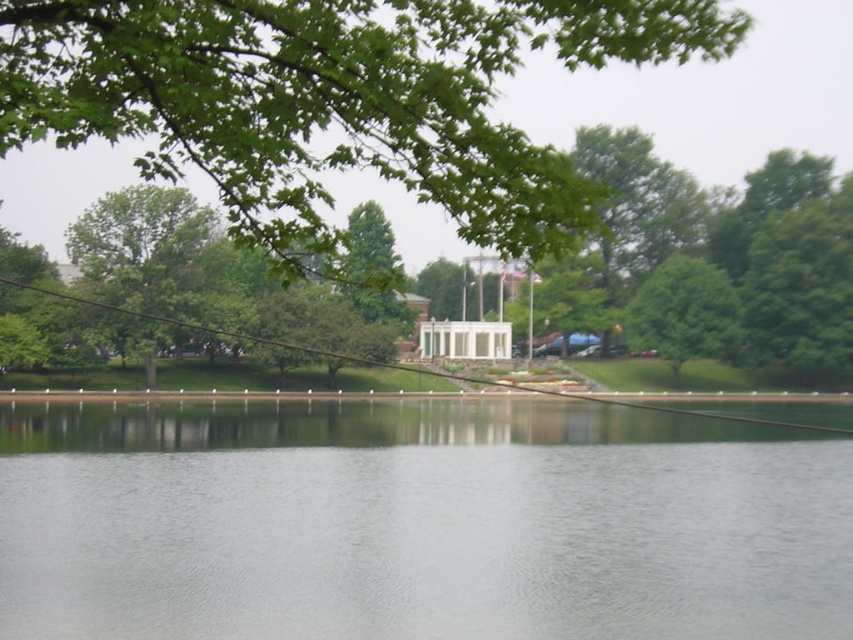
Find the location of a particular element. green leafy branch at upper center is located at coordinates (334, 100).

From the picture: Is green leafy branch at upper center positioned before green leafy tree at center?

Yes.

This screenshot has height=640, width=853. I want to click on green leafy branch at upper center, so click(334, 100).

Between clear water at center and green leafy branch at upper center, which one appears on the left side from the viewer's perspective?

green leafy branch at upper center

Which is above, clear water at center or green leafy branch at upper center?

Positioned higher is green leafy branch at upper center.

Image resolution: width=853 pixels, height=640 pixels. I want to click on clear water at center, so click(x=416, y=522).

Does clear water at center appear over green leafy tree at center?

No.

This screenshot has height=640, width=853. What do you see at coordinates (416, 522) in the screenshot? I see `clear water at center` at bounding box center [416, 522].

Find the location of a particular element. clear water at center is located at coordinates (416, 522).